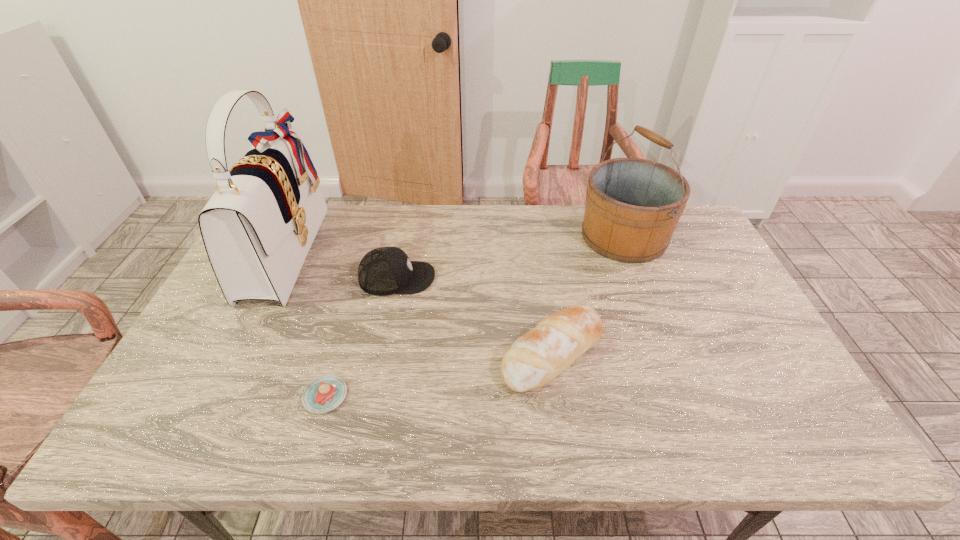
This screenshot has height=540, width=960. Find the location of `vacant space at the near edge of the desktop`. vacant space at the near edge of the desktop is located at coordinates [x=438, y=428].

At what (x,y) coordinates should I click in order to perform the action: click on free spot at the left edge of the desktop. Please return your answer as a coordinate pair (x, y). Image resolution: width=960 pixels, height=540 pixels. Looking at the image, I should click on (178, 363).

At what (x,y) coordinates should I click in order to perform the action: click on vacant space at the right edge of the desktop. Please return your answer as a coordinate pair (x, y). This screenshot has width=960, height=540. Looking at the image, I should click on (707, 275).

Image resolution: width=960 pixels, height=540 pixels. Identify the location of free space between the cap and the rightmost object. (511, 257).

Identify the location of vacant area between the bread and the leftmost object. This screenshot has height=540, width=960. (420, 302).

Where is `free point between the cap and the shortest object`? Image resolution: width=960 pixels, height=540 pixels. free point between the cap and the shortest object is located at coordinates (361, 337).

You are a GUI agent. You are given a task and a screenshot of the screen. Output one action in this format:
    pyautogui.click(x=<x>, y=<y>)
    Task: Click on the unoccupied position between the cap and the pastry
    The height and width of the screenshot is (540, 960).
    Given the screenshot: What is the action you would take?
    pyautogui.click(x=361, y=337)

You are a GUI agent. You are given a task and a screenshot of the screen. Output one action in this format:
    pyautogui.click(x=<x>, y=<y>)
    Task: Click on the vacant space that is in between the bread and the bucket
    The width and height of the screenshot is (960, 540).
    Given the screenshot: What is the action you would take?
    pyautogui.click(x=588, y=295)

Locate an element on the screen. The height and width of the screenshot is (540, 960). free space between the rightmost object and the cap is located at coordinates (511, 257).

What are the coordinates of `empty space between the second object from right to left and the tallest object` in the screenshot? It's located at (420, 302).